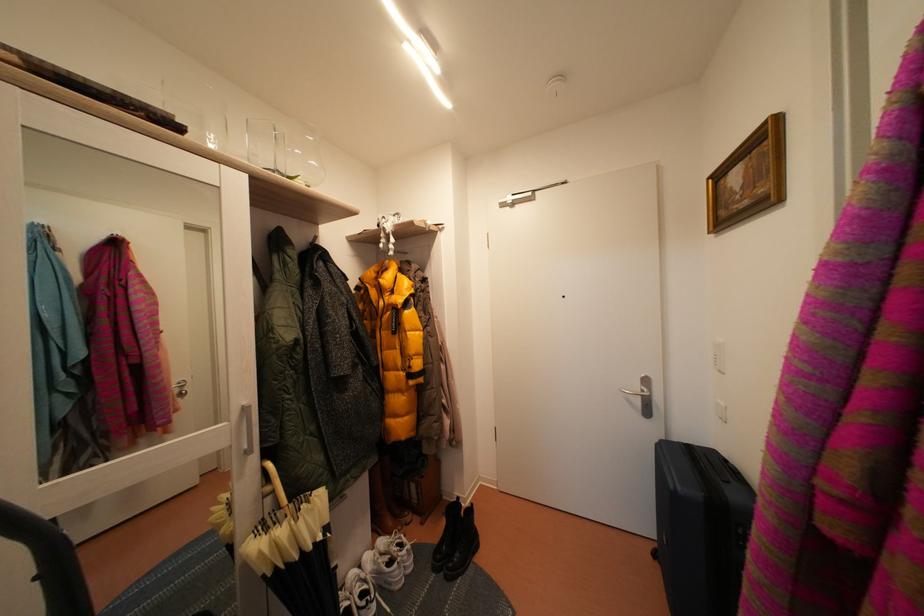
What do you see at coordinates (642, 395) in the screenshot? The image size is (924, 616). I see `the silver door handle` at bounding box center [642, 395].